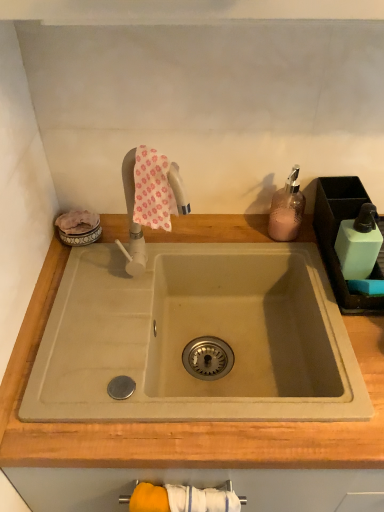
Where is `vacant space to the left of light green plastic soap dispenser at right`? This screenshot has width=384, height=512. vacant space to the left of light green plastic soap dispenser at right is located at coordinates (293, 249).